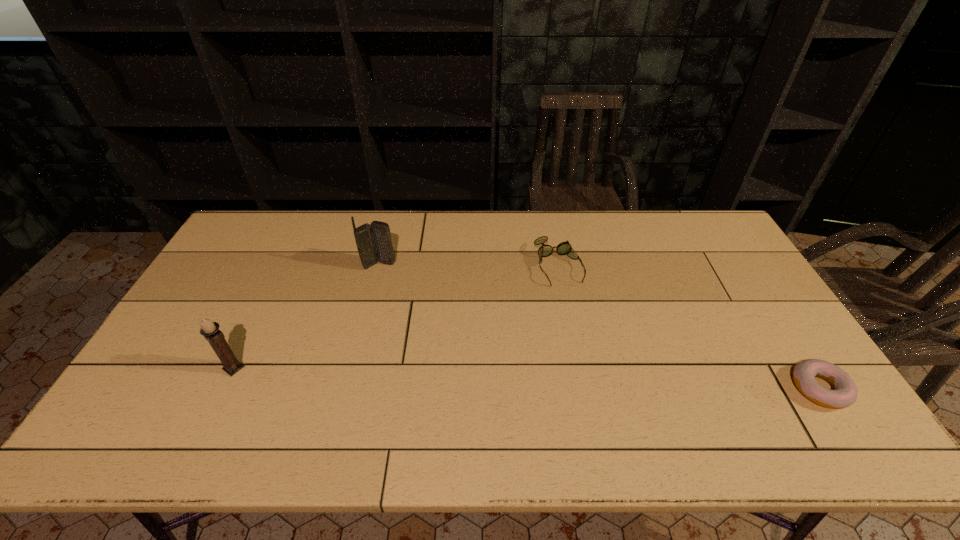
I want to click on free space located 0.090m on the keyboard of the cellular telephone, so click(x=407, y=282).

The height and width of the screenshot is (540, 960). What are the coordinates of `free space located 0.190m on the front-facing side of the second object from right to left` in the screenshot? It's located at (587, 334).

This screenshot has width=960, height=540. I want to click on free region located 0.160m on the front-facing side of the second object from right to left, so click(583, 326).

Image resolution: width=960 pixels, height=540 pixels. In order to click on vacant space situated 0.320m on the front-facing side of the second object from right to left in this screenshot , I will do `click(603, 372)`.

Locate an element on the screen. This screenshot has height=540, width=960. object that is at the far edge is located at coordinates (564, 248).

Locate an element on the screen. The width and height of the screenshot is (960, 540). object at the near edge is located at coordinates (845, 392).

Where is `object at the right edge`? Image resolution: width=960 pixels, height=540 pixels. object at the right edge is located at coordinates (845, 392).

What are the coordinates of `object that is at the near right corner` in the screenshot? It's located at (845, 392).

The image size is (960, 540). In the image, there is a desktop. In order to click on vacant space at the far edge in this screenshot , I will do pos(476,213).

In the image, there is a desktop. Where is `free space at the near edge`? Image resolution: width=960 pixels, height=540 pixels. free space at the near edge is located at coordinates (588, 388).